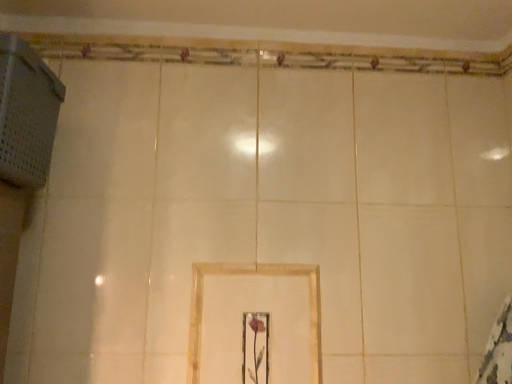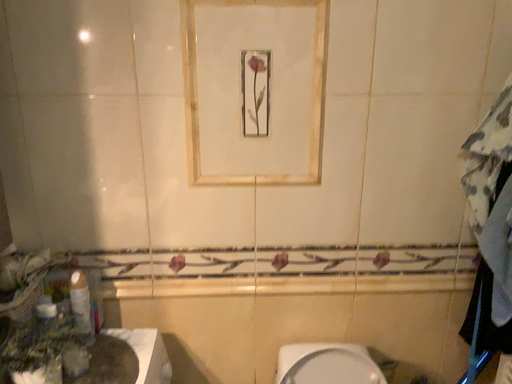
Question: How did the camera likely rotate when shooting the video?

Choices:
 (A) rotated upward
 (B) rotated downward

Answer: (B)